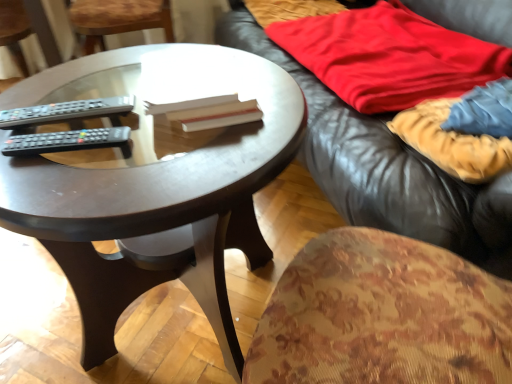
Question: Is dark wood coffee table at center located within velvet-like beige blanket at right, positioned as the first blanket in front-to-back order?

Choices:
 (A) yes
 (B) no

Answer: (B)

Question: From a real-world perspective, is velvet-like beige blanket at right, placed as the 2th blanket when sorted from back to front, positioned over dark wood coffee table at center based on gravity?

Choices:
 (A) yes
 (B) no

Answer: (A)

Question: Can you confirm if velvet-like beige blanket at right, positioned as the first blanket in front-to-back order, is smaller than dark wood coffee table at center?

Choices:
 (A) yes
 (B) no

Answer: (A)

Question: Can you confirm if velvet-like beige blanket at right, positioned as the first blanket in front-to-back order, is positioned to the right of dark wood coffee table at center?

Choices:
 (A) no
 (B) yes

Answer: (B)

Question: Is velvet-like beige blanket at right, placed as the 2th blanket when sorted from back to front, directly adjacent to dark wood coffee table at center?

Choices:
 (A) yes
 (B) no

Answer: (B)

Question: From a real-world perspective, is black plastic remote at center, marked as the 1th remote control in a back-to-front arrangement, positioned above or below black plastic remote control at left, positioned as the 2th remote control in back-to-front order?

Choices:
 (A) below
 (B) above

Answer: (A)

Question: Looking at their shapes, would you say black plastic remote at center, marked as the 1th remote control in a back-to-front arrangement, is wider or thinner than black plastic remote control at left, which is the 1th remote control in front-to-back order?

Choices:
 (A) thin
 (B) wide

Answer: (B)

Question: In the image, is black plastic remote at center, marked as the 1th remote control in a back-to-front arrangement, positioned in front of or behind black plastic remote control at left, which is the 1th remote control in front-to-back order?

Choices:
 (A) front
 (B) behind

Answer: (B)

Question: Considering the positions of black plastic remote at center, marked as the 1th remote control in a back-to-front arrangement, and black plastic remote control at left, positioned as the 2th remote control in back-to-front order, in the image, is black plastic remote at center, marked as the 1th remote control in a back-to-front arrangement, bigger or smaller than black plastic remote control at left, positioned as the 2th remote control in back-to-front order,?

Choices:
 (A) big
 (B) small

Answer: (A)

Question: Is leather couch at upper right bigger or smaller than velvet-like beige blanket at right, placed as the 2th blanket when sorted from back to front?

Choices:
 (A) small
 (B) big

Answer: (B)

Question: Is leather couch at upper right inside or outside of velvet-like beige blanket at right, positioned as the first blanket in front-to-back order?

Choices:
 (A) inside
 (B) outside

Answer: (B)

Question: Is leather couch at upper right taller or shorter than velvet-like beige blanket at right, placed as the 2th blanket when sorted from back to front?

Choices:
 (A) short
 (B) tall

Answer: (B)

Question: Is point (448, 240) positioned closer to the camera than point (465, 127)?

Choices:
 (A) closer
 (B) farther

Answer: (A)

Question: In terms of size, does black plastic remote at center, the 2th remote control in the front-to-back sequence, appear bigger or smaller than red cotton blanket at upper right, arranged as the first blanket when viewed from the back?

Choices:
 (A) big
 (B) small

Answer: (B)

Question: From a real-world perspective, is black plastic remote at center, the 2th remote control in the front-to-back sequence, positioned above or below red cotton blanket at upper right, arranged as the first blanket when viewed from the back?

Choices:
 (A) below
 (B) above

Answer: (B)